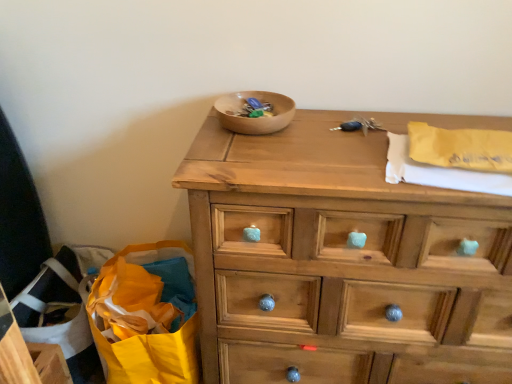
At what (x,y) coordinates should I click in order to perform the action: click on free space to the left of yellow paper at upper right. Please return your answer as a coordinate pair (x, y). The image size is (512, 384). Looking at the image, I should click on (343, 155).